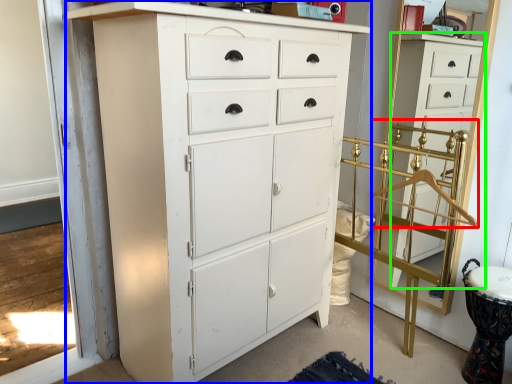
Question: Which is nearer to the hanger (highlighted by a red box)? chest of drawers (highlighted by a blue box) or chest of drawers (highlighted by a green box).

Choices:
 (A) chest of drawers
 (B) chest of drawers

Answer: (B)